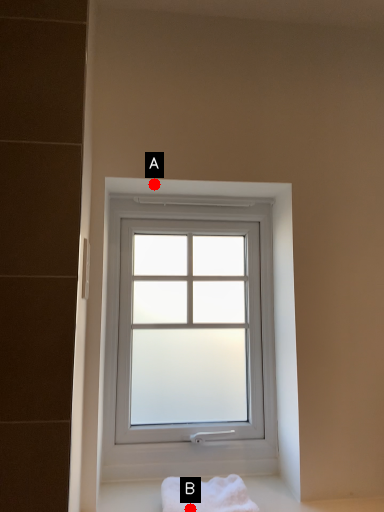
Question: Two points are circled on the image, labeled by A and B beside each circle. Which point is closer to the camera taking this photo?

Choices:
 (A) A is closer
 (B) B is closer

Answer: (B)